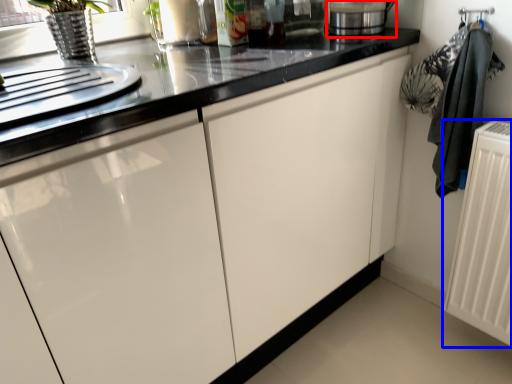
Question: Among these objects, which one is farthest to the camera, appliance (highlighted by a red box) or radiator (highlighted by a blue box)?

Choices:
 (A) appliance
 (B) radiator

Answer: (A)